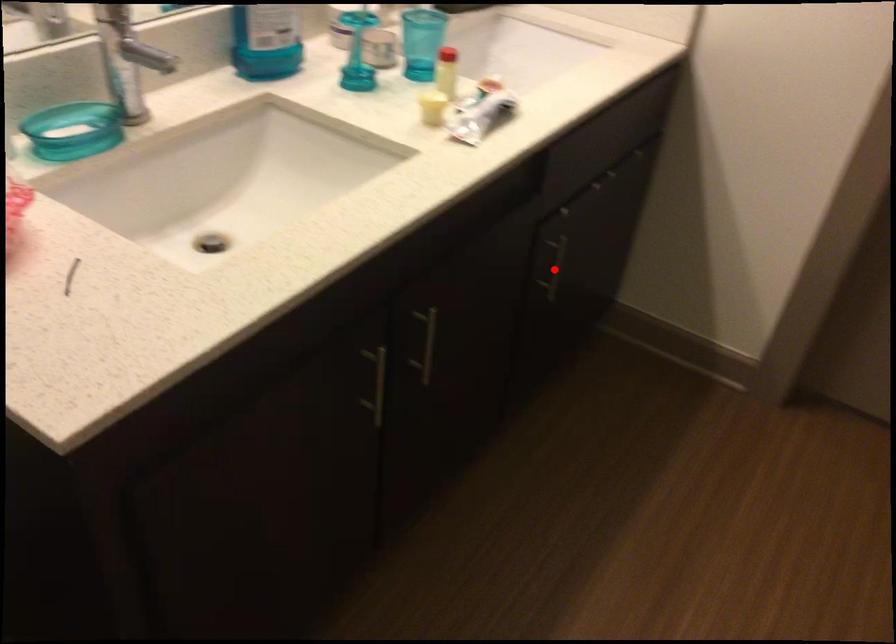
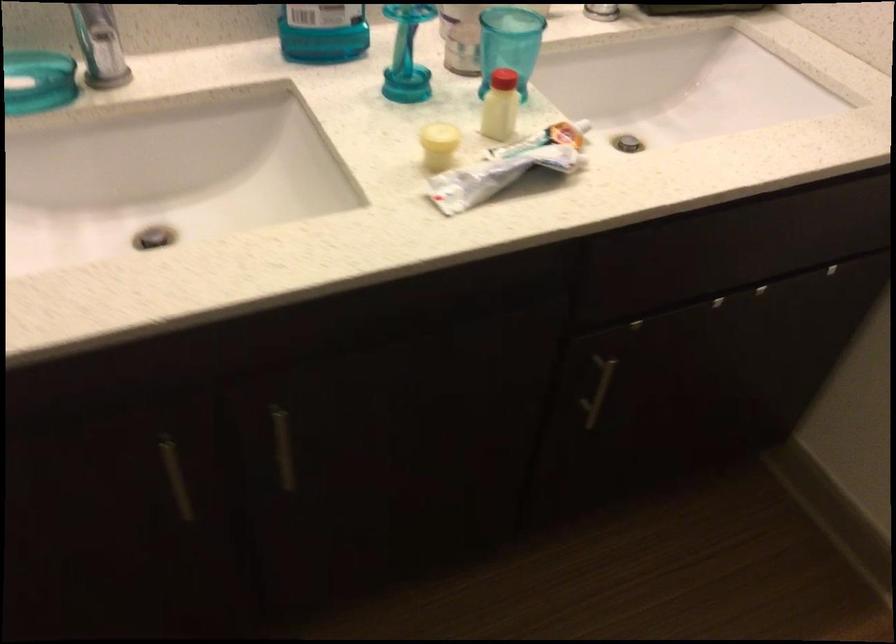
Find the pixel in the second image that matches the highlighted location in the first image.

(598, 391)